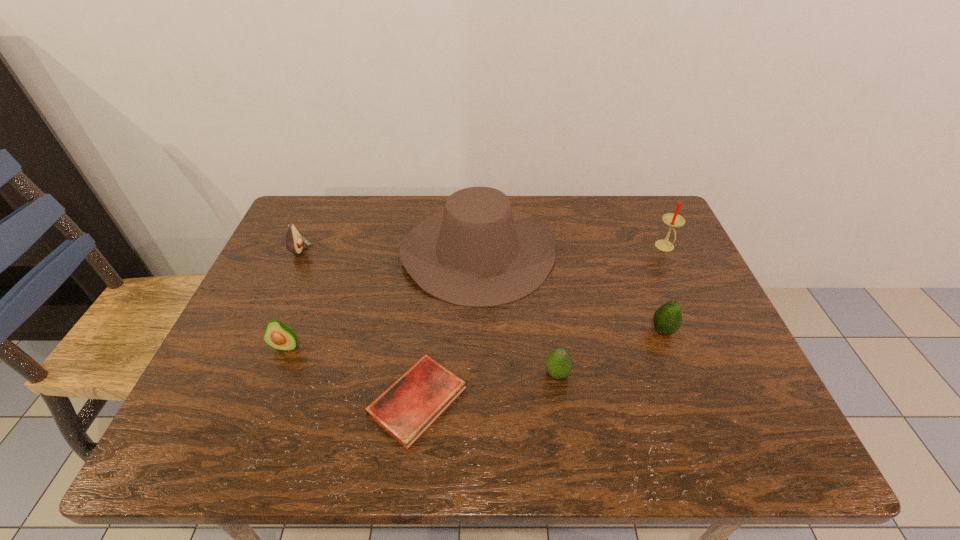
Where is `free space located 0.070m on the seed side of the leftmost avocado`? The image size is (960, 540). free space located 0.070m on the seed side of the leftmost avocado is located at coordinates (334, 249).

At what (x,y) coordinates should I click in order to perform the action: click on vacant space situated 0.160m on the cut side of the second object from left to right. Please return your answer as a coordinate pair (x, y). The width and height of the screenshot is (960, 540). Looking at the image, I should click on (257, 420).

Find the location of a particular element. The height and width of the screenshot is (540, 960). vacant region located on the front of the rightmost avocado is located at coordinates (686, 394).

At what (x,y) coordinates should I click in order to perform the action: click on vacant space situated 0.340m on the left of the second avocado from right to left. Please return your answer as a coordinate pair (x, y). This screenshot has height=540, width=960. Looking at the image, I should click on (389, 374).

At what (x,y) coordinates should I click in order to perform the action: click on vacant region located on the back of the shortest object. Please return your answer as a coordinate pair (x, y). This screenshot has height=540, width=960. Looking at the image, I should click on (426, 323).

The width and height of the screenshot is (960, 540). In order to click on cowboy hat present at the far edge in this screenshot , I will do `click(478, 252)`.

Find the location of a particular element. The image size is (960, 540). candle that is positioned at the far edge is located at coordinates (673, 220).

Identify the location of avocado situated at the far edge. This screenshot has height=540, width=960. (294, 241).

This screenshot has width=960, height=540. I want to click on object located at the near edge, so click(406, 409).

You are a GUI agent. You are given a task and a screenshot of the screen. Output one action in this format:
    pyautogui.click(x=<x>, y=<y>)
    Task: Click on the candle positioned at the right edge
    This screenshot has width=960, height=540.
    Given the screenshot: What is the action you would take?
    pyautogui.click(x=673, y=220)